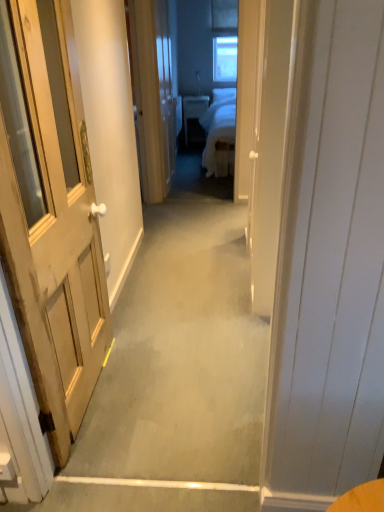
Question: From the image's perspective, is wooden door at left under clear glass window at upper center?

Choices:
 (A) yes
 (B) no

Answer: (A)

Question: Is wooden door at left taller than clear glass window at upper center?

Choices:
 (A) yes
 (B) no

Answer: (A)

Question: Can you confirm if wooden door at left is bigger than clear glass window at upper center?

Choices:
 (A) yes
 (B) no

Answer: (A)

Question: Would you say clear glass window at upper center is part of wooden door at left's contents?

Choices:
 (A) yes
 (B) no

Answer: (B)

Question: From the image's perspective, is wooden door at left above clear glass window at upper center?

Choices:
 (A) yes
 (B) no

Answer: (B)

Question: Do you think wooden door at left is within carpeted hallway at center, or outside of it?

Choices:
 (A) inside
 (B) outside

Answer: (B)

Question: Is wooden door at left to the left or to the right of carpeted hallway at center in the image?

Choices:
 (A) right
 (B) left

Answer: (B)

Question: In terms of height, does wooden door at left look taller or shorter compared to carpeted hallway at center?

Choices:
 (A) tall
 (B) short

Answer: (A)

Question: In the image, is wooden door at left positioned in front of or behind carpeted hallway at center?

Choices:
 (A) front
 (B) behind

Answer: (A)

Question: In terms of size, does clear glass window at upper center appear bigger or smaller than carpeted hallway at center?

Choices:
 (A) big
 (B) small

Answer: (B)

Question: In terms of width, does clear glass window at upper center look wider or thinner when compared to carpeted hallway at center?

Choices:
 (A) wide
 (B) thin

Answer: (B)

Question: Which is correct: clear glass window at upper center is inside carpeted hallway at center, or outside of it?

Choices:
 (A) inside
 (B) outside

Answer: (B)

Question: In the image, is clear glass window at upper center positioned in front of or behind carpeted hallway at center?

Choices:
 (A) behind
 (B) front

Answer: (A)

Question: From a real-world perspective, relative to wooden door at left, is clear glass window at upper center vertically above or below?

Choices:
 (A) below
 (B) above

Answer: (B)

Question: Is clear glass window at upper center wider or thinner than wooden door at left?

Choices:
 (A) thin
 (B) wide

Answer: (A)